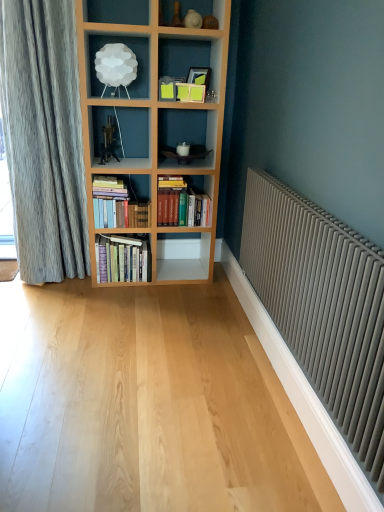
Question: Is matte gray radiator at right located within hardcover books at center, the third book positioned from the right?

Choices:
 (A) yes
 (B) no

Answer: (B)

Question: Is hardcover books at center, which ranks as the first book in left-to-right order, aimed at matte gray radiator at right?

Choices:
 (A) yes
 (B) no

Answer: (A)

Question: Is hardcover books at center, the third book positioned from the right, outside of matte gray radiator at right?

Choices:
 (A) no
 (B) yes

Answer: (B)

Question: Is hardcover books at center, the third book positioned from the right, to the right of matte gray radiator at right from the viewer's perspective?

Choices:
 (A) yes
 (B) no

Answer: (B)

Question: Is hardcover books at center, which ranks as the first book in left-to-right order, bigger than matte gray radiator at right?

Choices:
 (A) no
 (B) yes

Answer: (A)

Question: From a real-world perspective, relative to white cloud lamp at upper center, is hardcover books at center, the third book positioned from the right, vertically above or below?

Choices:
 (A) below
 (B) above

Answer: (A)

Question: Considering their positions, is hardcover books at center, the third book positioned from the right, located in front of or behind white cloud lamp at upper center?

Choices:
 (A) behind
 (B) front

Answer: (A)

Question: Looking at the image, does hardcover books at center, the third book positioned from the right, seem bigger or smaller compared to white cloud lamp at upper center?

Choices:
 (A) big
 (B) small

Answer: (A)

Question: Which is correct: hardcover books at center, which ranks as the first book in left-to-right order, is inside white cloud lamp at upper center, or outside of it?

Choices:
 (A) inside
 (B) outside

Answer: (B)

Question: From the image's perspective, is matte gray radiator at right above or below hardcover books at center, which ranks as the first book in left-to-right order?

Choices:
 (A) above
 (B) below

Answer: (B)

Question: Is matte gray radiator at right spatially inside hardcover books at center, the third book positioned from the right, or outside of it?

Choices:
 (A) outside
 (B) inside

Answer: (A)

Question: From their relative heights in the image, would you say matte gray radiator at right is taller or shorter than hardcover books at center, the third book positioned from the right?

Choices:
 (A) tall
 (B) short

Answer: (A)

Question: Is point (337, 307) positioned closer to the camera than point (129, 278)?

Choices:
 (A) farther
 (B) closer

Answer: (B)

Question: From a real-world perspective, is white cloud lamp at upper center physically located above or below hardcover books at center, which ranks as the first book in left-to-right order?

Choices:
 (A) above
 (B) below

Answer: (A)

Question: Based on their positions, is white cloud lamp at upper center located to the left or right of hardcover books at center, the third book positioned from the right?

Choices:
 (A) left
 (B) right

Answer: (B)